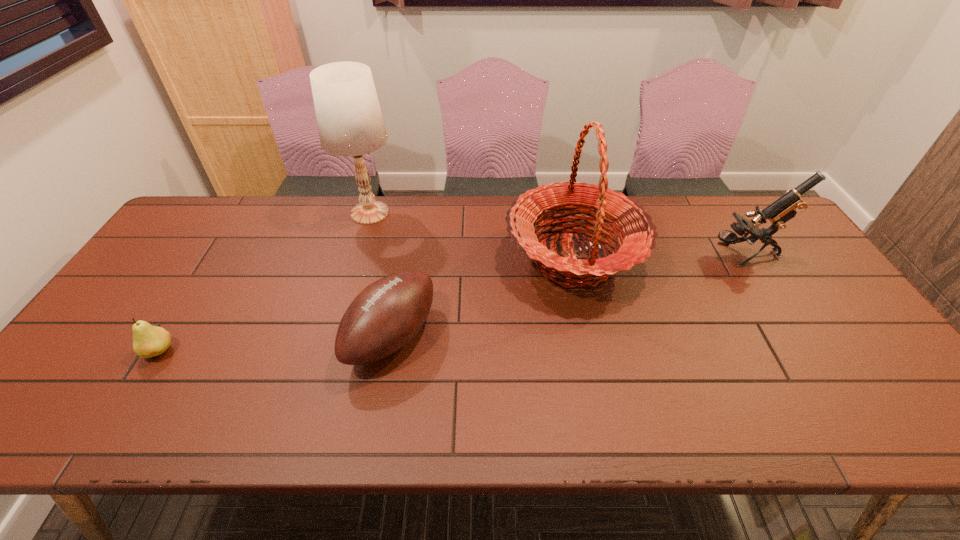
I want to click on free space located 0.250m through the eyepiece of the rightmost object, so click(x=626, y=255).

I want to click on blank space located through the eyepiece of the rightmost object, so [677, 255].

Find the location of a particular element. The width and height of the screenshot is (960, 540). free space located 0.260m on the left of the fourth tallest object is located at coordinates (247, 336).

This screenshot has width=960, height=540. What are the coordinates of `vacant area situated 0.050m on the left of the pear` in the screenshot? It's located at (124, 352).

At what (x,y) coordinates should I click in order to perform the action: click on lamp present at the far edge. Please return your answer as a coordinate pair (x, y). This screenshot has height=540, width=960. Looking at the image, I should click on (350, 123).

Find the location of a particular element. The image size is (960, 540). basket located at the far edge is located at coordinates (636, 231).

Identify the location of object at the left edge. (148, 341).

Image resolution: width=960 pixels, height=540 pixels. I want to click on object positioned at the right edge, so click(785, 208).

The width and height of the screenshot is (960, 540). In order to click on free region at the far edge of the desktop in this screenshot , I will do `click(481, 215)`.

In the image, there is a desktop. Identify the location of free space at the near edge. This screenshot has height=540, width=960. (429, 416).